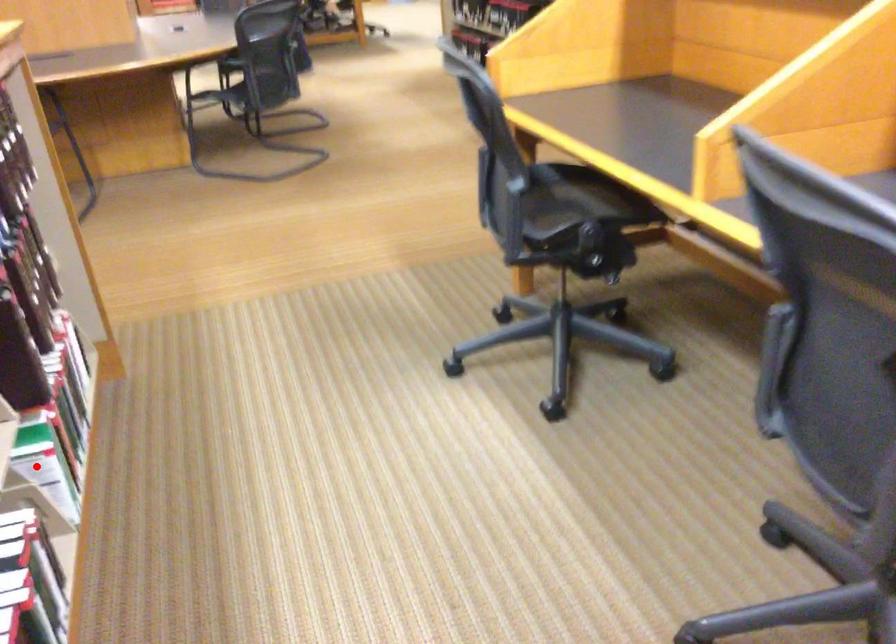
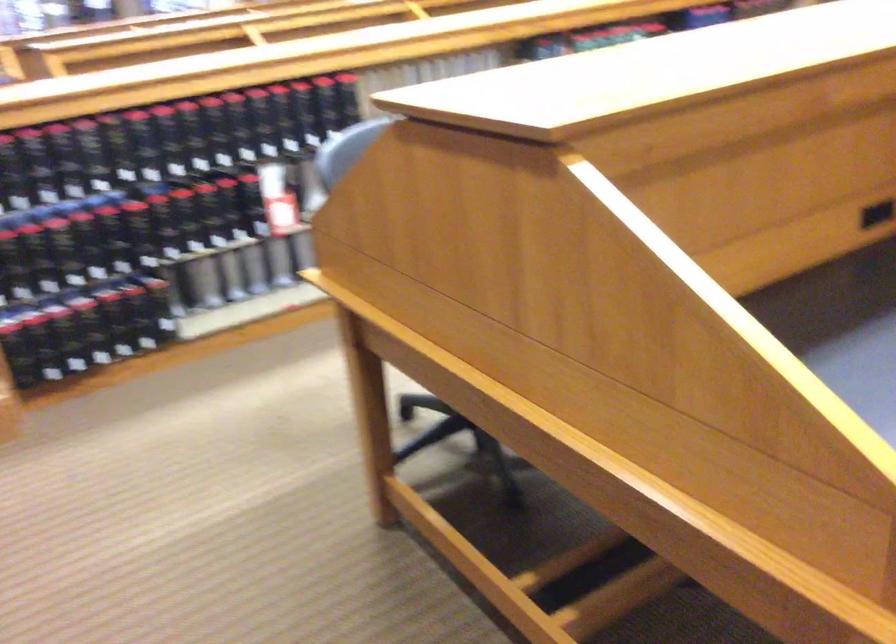
Question: I am providing you with two images of the same scene from different viewpoints. A red point is marked on the first image. Can you still see the location of the red point in image 2?

Choices:
 (A) Yes
 (B) No

Answer: (B)